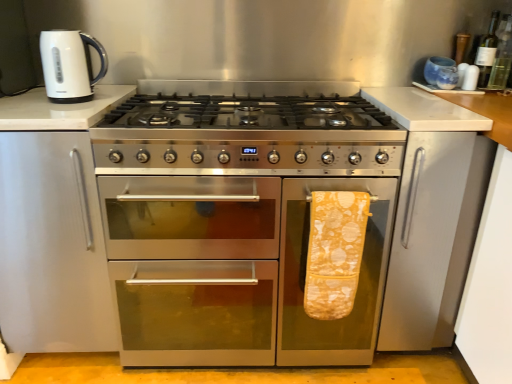
Locate an element on the screen. The width and height of the screenshot is (512, 384). free area below white glossy electric kettle at upper left (from a real-world perspective) is located at coordinates (83, 94).